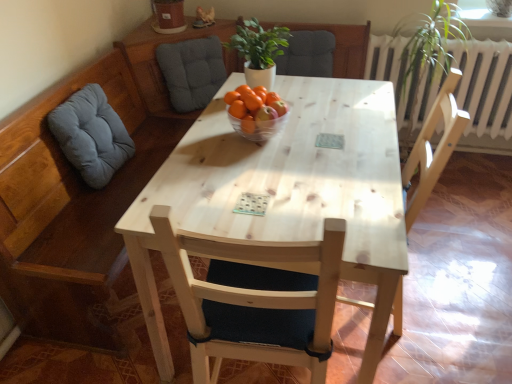
Question: Does gray fabric cushion at upper left, which ranks as the 2th swivel chair in front-to-back order, have a lesser width compared to light wood chair at center, the second chair viewed from the right?

Choices:
 (A) yes
 (B) no

Answer: (A)

Question: Does gray fabric cushion at upper left, positioned as the 1th swivel chair in back-to-front order, have a larger size compared to light wood chair at center, positioned as the 1th chair in left-to-right order?

Choices:
 (A) yes
 (B) no

Answer: (B)

Question: From a real-world perspective, is gray fabric cushion at upper left, which ranks as the 2th swivel chair in front-to-back order, positioned over light wood chair at center, positioned as the 1th chair in left-to-right order, based on gravity?

Choices:
 (A) yes
 (B) no

Answer: (A)

Question: Is gray fabric cushion at upper left, which ranks as the first swivel chair in right-to-left order, positioned behind light wood chair at center, the second chair viewed from the right?

Choices:
 (A) no
 (B) yes

Answer: (B)

Question: Considering the relative sizes of gray fabric cushion at upper left, which ranks as the first swivel chair in right-to-left order, and light wood chair at center, positioned as the 1th chair in left-to-right order, in the image provided, is gray fabric cushion at upper left, which ranks as the first swivel chair in right-to-left order, shorter than light wood chair at center, positioned as the 1th chair in left-to-right order,?

Choices:
 (A) no
 (B) yes

Answer: (B)

Question: From a real-world perspective, is gray fabric cushion at upper left, the 2th swivel chair positioned from the left, positioned under light wood chair at center, the second chair viewed from the right, based on gravity?

Choices:
 (A) no
 (B) yes

Answer: (A)

Question: Is white matte plant at center to the left of light wood chair at center, positioned as the 1th chair in left-to-right order, from the viewer's perspective?

Choices:
 (A) yes
 (B) no

Answer: (A)

Question: From the image's perspective, is white matte plant at center located above light wood chair at center, the second chair viewed from the right?

Choices:
 (A) yes
 (B) no

Answer: (A)

Question: Are white matte plant at center and light wood chair at center, positioned as the 1th chair in left-to-right order, making contact?

Choices:
 (A) no
 (B) yes

Answer: (A)

Question: Considering the relative sizes of white matte plant at center and light wood chair at center, positioned as the 1th chair in left-to-right order, in the image provided, is white matte plant at center smaller than light wood chair at center, positioned as the 1th chair in left-to-right order,?

Choices:
 (A) yes
 (B) no

Answer: (A)

Question: Does white matte plant at center have a lesser width compared to light wood chair at center, the second chair viewed from the right?

Choices:
 (A) no
 (B) yes

Answer: (B)

Question: Is white matte plant at center facing away from light wood chair at center, the second chair viewed from the right?

Choices:
 (A) yes
 (B) no

Answer: (B)

Question: Can you confirm if transparent glass bowl at center is thinner than light wood chair at center, positioned as the 1th chair in left-to-right order?

Choices:
 (A) yes
 (B) no

Answer: (A)